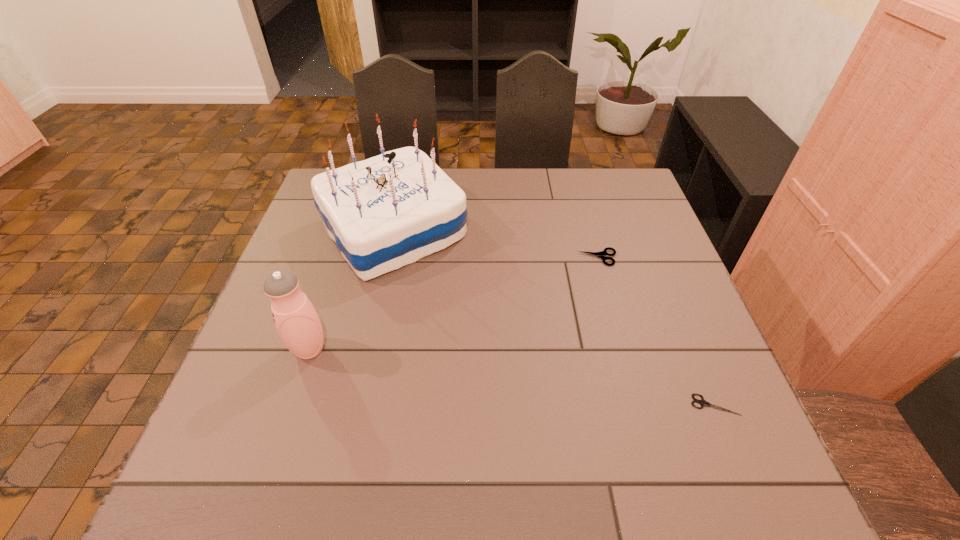
I want to click on free space between the tallest object and the taller shears, so click(x=495, y=244).

Image resolution: width=960 pixels, height=540 pixels. What are the coordinates of `empty space between the third shortest object and the tallest object` in the screenshot? It's located at tap(351, 290).

Identify the location of the third closest object to the birthday cake. (702, 402).

Image resolution: width=960 pixels, height=540 pixels. Identify the location of object that can be found as the second closest to the farther shears. (702, 402).

I want to click on vacant position in the image that satisfies the following two spatial constraints: 1. on the front side of the farther shears; 2. on the right side of the nearer shears, so click(639, 404).

The width and height of the screenshot is (960, 540). Find the location of `vacant region that satisfies the following two spatial constraints: 1. on the front side of the nearer shears; 2. on the right side of the second tallest object`. vacant region that satisfies the following two spatial constraints: 1. on the front side of the nearer shears; 2. on the right side of the second tallest object is located at coordinates (291, 404).